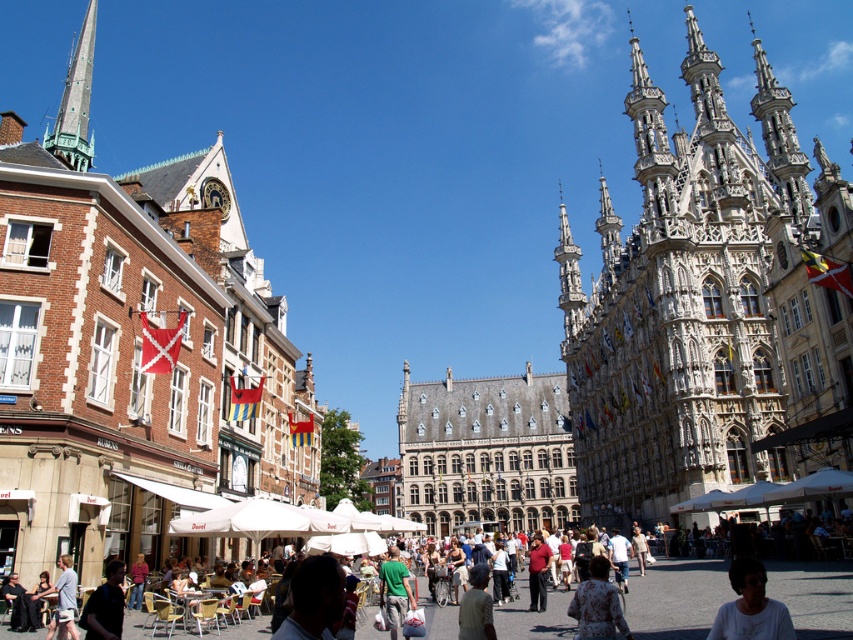
Is shiny green spire at upper left taller than white matte shirt at lower right?

Yes, shiny green spire at upper left is taller than white matte shirt at lower right.

Does shiny green spire at upper left have a lesser height compared to white matte shirt at lower right?

Incorrect, shiny green spire at upper left's height does not fall short of white matte shirt at lower right's.

Is point (79, 166) in front of point (780, 620)?

No, (79, 166) is behind (780, 620).

Find the location of a particular element. shiny green spire at upper left is located at coordinates (74, 102).

The image size is (853, 640). Find the location of `light brown leather jacket at center`. light brown leather jacket at center is located at coordinates (676, 596).

Which is behind, point (695, 616) or point (608, 628)?

Point (695, 616)

At what (x,y) coordinates should I click in order to perform the action: click on light brown leather jacket at center. Please return your answer as a coordinate pair (x, y). This screenshot has width=853, height=640. Looking at the image, I should click on (676, 596).

Which is behind, point (834, 636) or point (746, 620)?

Positioned behind is point (834, 636).

Is point (827, 570) farther from viewer compared to point (735, 588)?

Yes.

Between point (842, 563) and point (726, 605), which one is positioned behind?

The point (842, 563) is behind.

You are a GUI agent. You are given a task and a screenshot of the screen. Output one action in this format:
    pyautogui.click(x=<x>, y=<y>)
    Task: Click on the light brown leather jacket at center
    
    Given the screenshot: What is the action you would take?
    pyautogui.click(x=676, y=596)